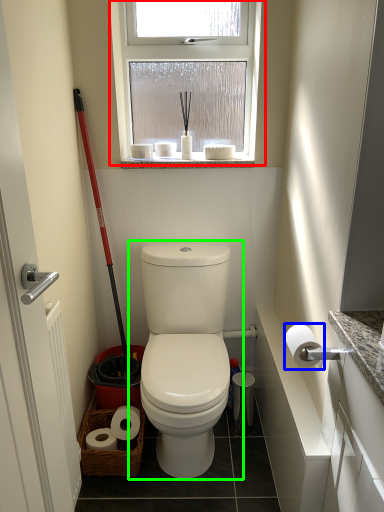
Question: Estimate the real-world distances between objects in this image. Which object is farther from window (highlighted by a red box), toilet paper (highlighted by a blue box) or toilet (highlighted by a green box)?

Choices:
 (A) toilet paper
 (B) toilet

Answer: (A)